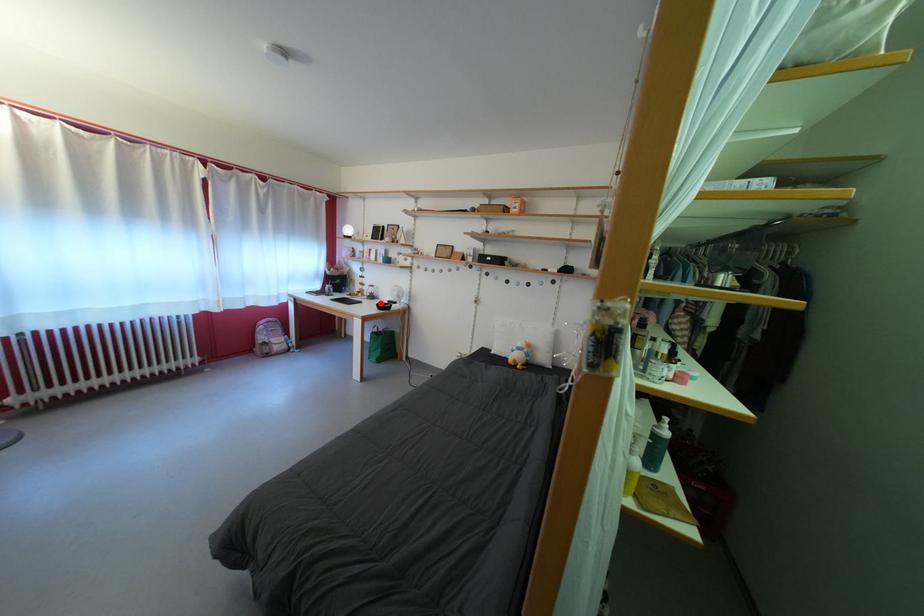
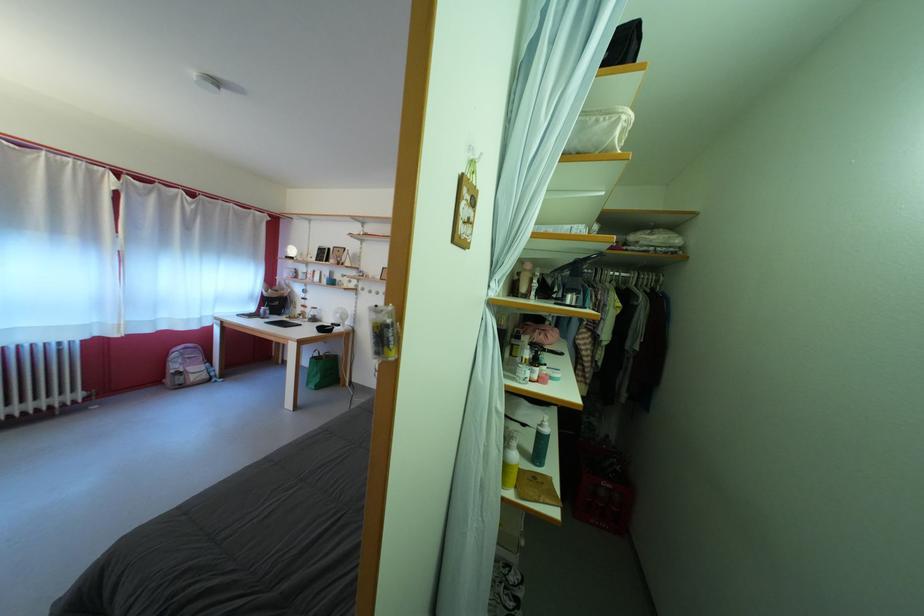
Question: I am providing you with two images of the same scene from different viewpoints. A red point is marked on the first image. Can you still see the location of the red point in image 2?

Choices:
 (A) Yes
 (B) No

Answer: (A)